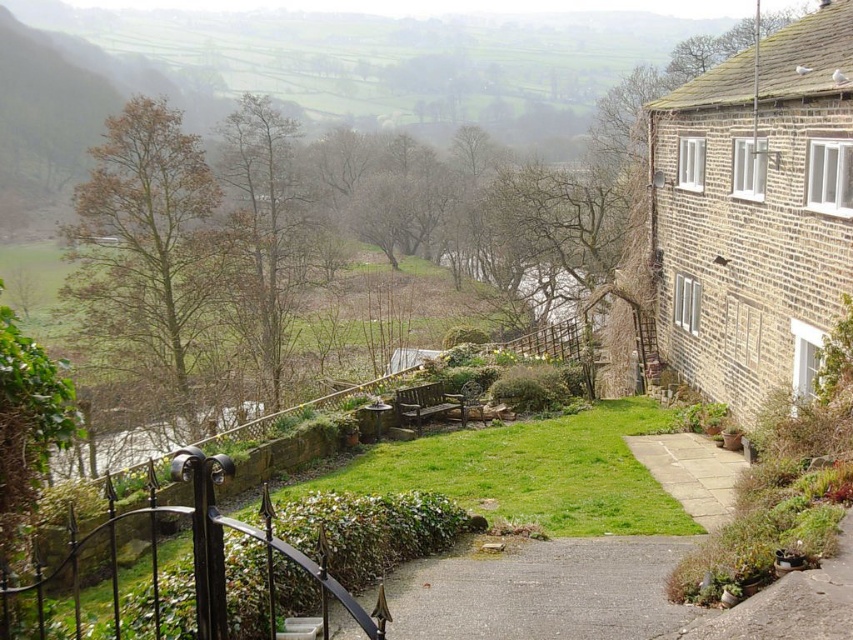
Does point (691, 545) lie in front of point (666, 467)?

That is True.

Can you confirm if gray gravel path at center is positioned to the right of light gray stone path at center?

No, gray gravel path at center is not to the right of light gray stone path at center.

Image resolution: width=853 pixels, height=640 pixels. What do you see at coordinates (543, 592) in the screenshot?
I see `gray gravel path at center` at bounding box center [543, 592].

The width and height of the screenshot is (853, 640). In order to click on gray gravel path at center in this screenshot , I will do `click(543, 592)`.